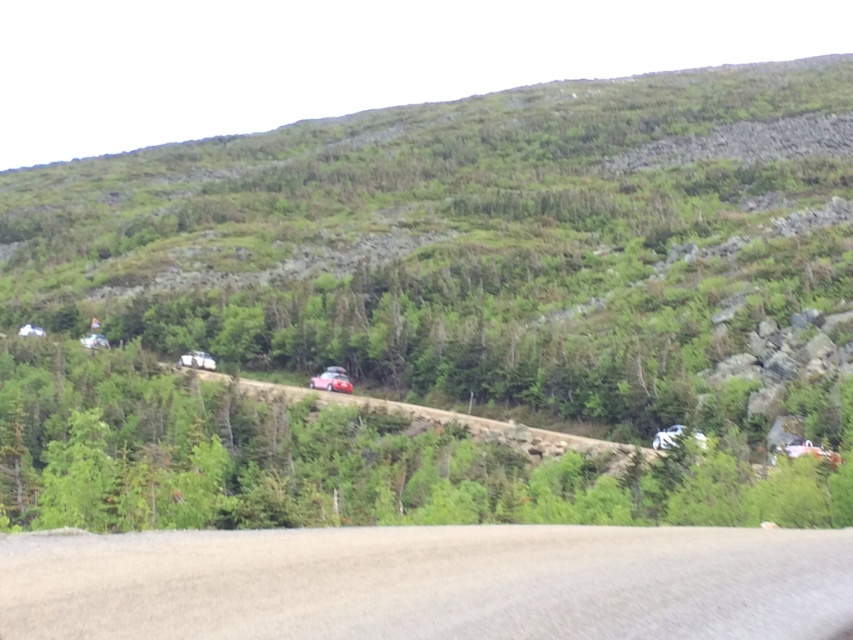
Does green matte tree at center appear over glossy red car at center?

Incorrect, green matte tree at center is not positioned above glossy red car at center.

Does green matte tree at center have a lesser height compared to glossy red car at center?

Incorrect, green matte tree at center's height does not fall short of glossy red car at center's.

This screenshot has width=853, height=640. What do you see at coordinates (329, 461) in the screenshot? I see `green matte tree at center` at bounding box center [329, 461].

I want to click on green matte tree at center, so click(x=329, y=461).

Which of these two, brown gravel road at lower center or metallic silver car at center, stands taller?

metallic silver car at center is taller.

Is brown gravel road at lower center wider than metallic silver car at center?

Yes, brown gravel road at lower center is wider than metallic silver car at center.

Is point (743, 616) farther from camera compared to point (682, 429)?

No.

This screenshot has height=640, width=853. In order to click on brown gravel road at lower center in this screenshot , I will do `click(428, 582)`.

Who is positioned more to the left, green matte tree at center or metallic silver car at center?

From the viewer's perspective, green matte tree at center appears more on the left side.

Who is taller, green matte tree at center or metallic silver car at center?

green matte tree at center is taller.

Is point (181, 403) less distant than point (662, 440)?

No, (181, 403) is further to viewer.

Find the location of a particular element. green matte tree at center is located at coordinates [329, 461].